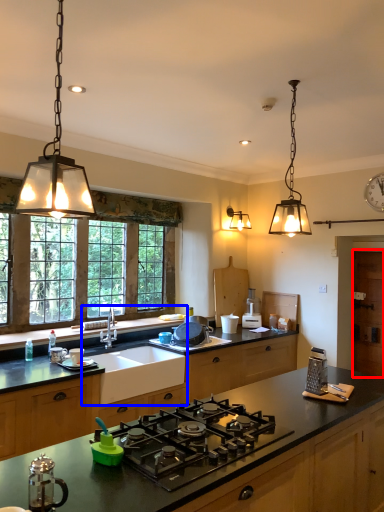
Question: Which object appears closest to the camera in this image, cabinetry (highlighted by a red box) or sink (highlighted by a blue box)?

Choices:
 (A) cabinetry
 (B) sink

Answer: (B)